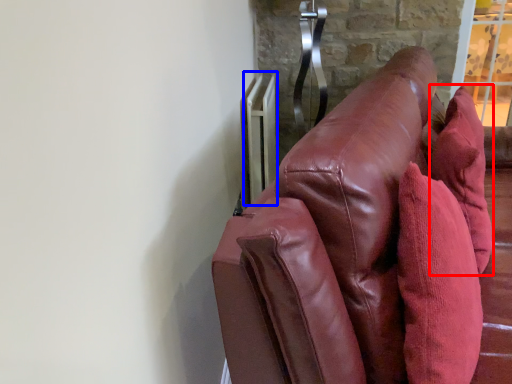
Question: Which object appears closest to the camera in this image, throw pillow (highlighted by a red box) or radiator (highlighted by a blue box)?

Choices:
 (A) throw pillow
 (B) radiator

Answer: (A)